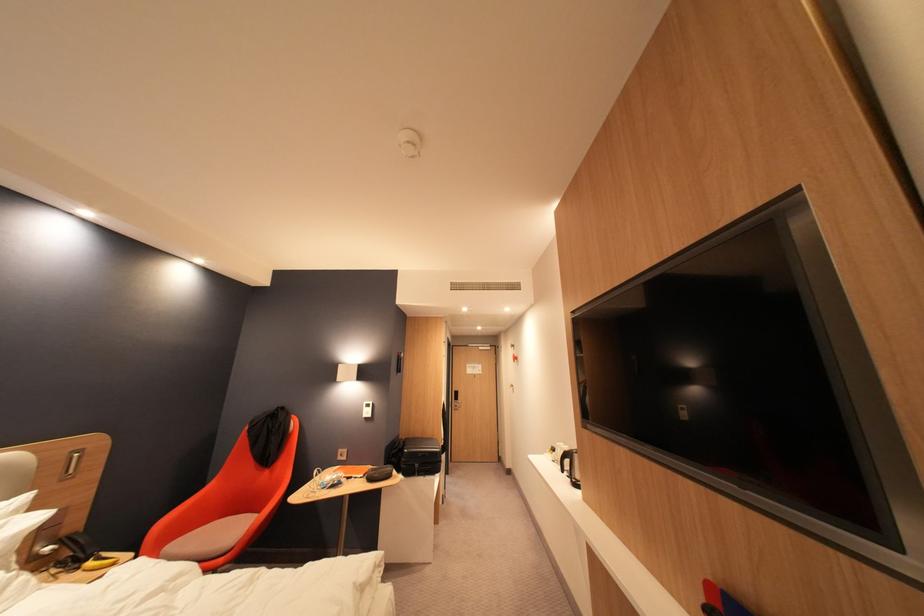
Locate an element on the screen. red chair sitting surface is located at coordinates point(201,536).